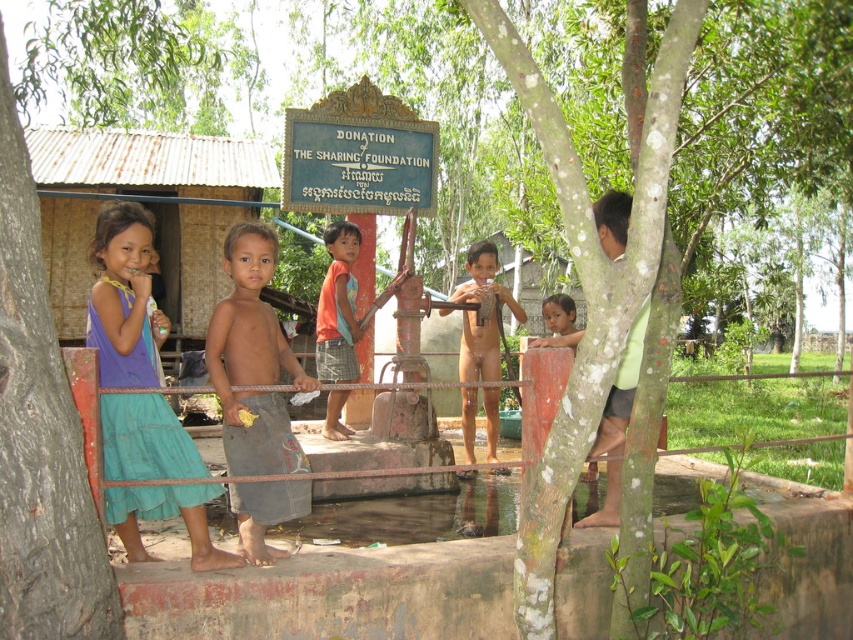
Question: Which object appears closest to the camera in this image?

Choices:
 (A) orange fabric shirt at center
 (B) white textured tree at center
 (C) green rough bark tree at left
 (D) naked boy at center

Answer: (B)

Question: Is the position of gray fabric shorts at center less distant than that of green matte shirt at upper right?

Choices:
 (A) no
 (B) yes

Answer: (A)

Question: Estimate the real-world distances between objects in this image. Which object is closer to the green rough bark tree at left?

Choices:
 (A) blue cotton dress at left
 (B) white textured tree at center
 (C) gray fabric shorts at center

Answer: (A)

Question: Can you confirm if green matte shirt at upper right is positioned to the right of naked boy at center?

Choices:
 (A) yes
 (B) no

Answer: (A)

Question: Does blue cotton dress at left appear under light brown skin at upper center?

Choices:
 (A) yes
 (B) no

Answer: (A)

Question: Which point appears closest to the camera in this image?

Choices:
 (A) (80, 433)
 (B) (624, 499)

Answer: (A)